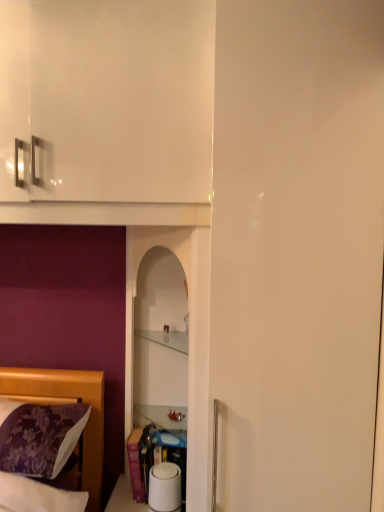
Question: In the image, is clear glass cabinet at center positioned in front of or behind transparent glass shelf at center?

Choices:
 (A) behind
 (B) front

Answer: (A)

Question: Does point (170, 338) appear closer or farther from the camera than point (135, 287)?

Choices:
 (A) closer
 (B) farther

Answer: (B)

Question: Which of these objects is positioned closest to the transparent glass shelf at center?

Choices:
 (A) purple floral fabric at lower left
 (B) clear glass cabinet at center

Answer: (B)

Question: Estimate the real-world distances between objects in this image. Which object is farther from the purple floral fabric at lower left?

Choices:
 (A) clear glass cabinet at center
 (B) transparent glass shelf at center

Answer: (A)